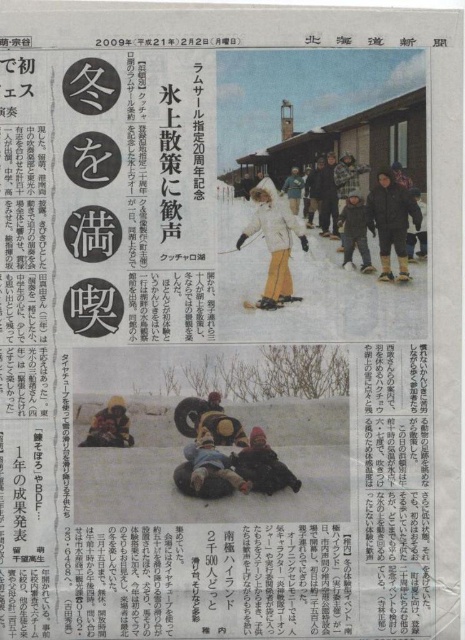
Can you confirm if dark brown fur coat at center is positioned above yellow fuzzy hat at center?

Correct, dark brown fur coat at center is located above yellow fuzzy hat at center.

Who is higher up, dark brown fur coat at center or yellow fuzzy hat at center?

dark brown fur coat at center is higher up.

Describe the element at coordinates (391, 221) in the screenshot. The height and width of the screenshot is (640, 465). I see `dark brown fur coat at center` at that location.

You are a GUI agent. You are given a task and a screenshot of the screen. Output one action in this format:
    pyautogui.click(x=<x>, y=<y>)
    Task: Click on the dark brown fur coat at center
    
    Given the screenshot: What is the action you would take?
    pyautogui.click(x=391, y=221)

Does point (370, 204) come closer to viewer compared to point (253, 456)?

Yes, point (370, 204) is closer to viewer.

Find the location of a particular element. The image size is (465, 640). dark brown fur coat at center is located at coordinates (391, 221).

Is point (382, 234) closer to viewer compared to point (271, 470)?

That is False.

Locate an element on the screen. dark brown fur coat at center is located at coordinates (391, 221).

Between dark brown fur hat at center and yellow fuzzy hat at center, which one has less height?

With less height is yellow fuzzy hat at center.

Does dark brown fur hat at center have a lesser height compared to yellow fuzzy hat at center?

No.

Describe the element at coordinates (263, 467) in the screenshot. I see `dark brown fur hat at center` at that location.

Identify the location of dark brown fur hat at center. (263, 467).